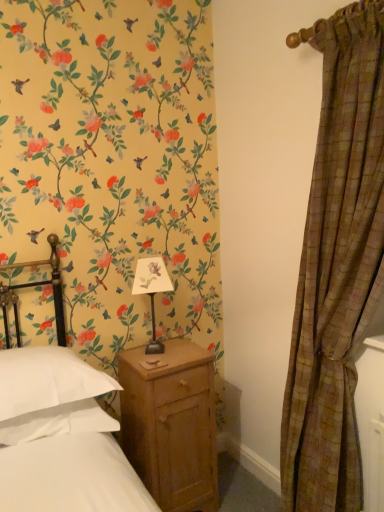
You are a GUI agent. You are given a task and a screenshot of the screen. Output one action in this format:
    pyautogui.click(x=<x>, y=<y>)
    Task: Click on the vacant region under matte black table lamp at center (from a real-world perspective)
    
    Given the screenshot: What is the action you would take?
    pyautogui.click(x=155, y=351)